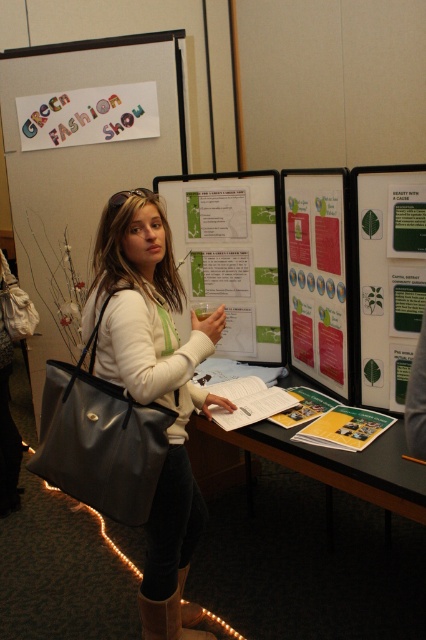
You are standing in the exhibition hall and see two points marked in the image. The first point is at coordinate point (40, 349) and the second point is at coordinate point (259, 301). Which point is closer to you?

Point (40, 349) is closer to you because it is further to the camera than point (259, 301).

You are at an event and want to read both the green paper poster at center and the colorful paper sign at upper left. Which one should you look at first if you want to start from the higher position?

The colorful paper sign at upper left is positioned higher than the green paper poster at center, so you should look at the colorful paper sign at upper left first.

In the scene shown: You are at an event and want to read both the matte white poster at upper left and the green paper poster at center. Which poster should you look at first if you want to read them in the order they are displayed from top to bottom?

You should look at the matte white poster at upper left first because it is located above the green paper poster at center.